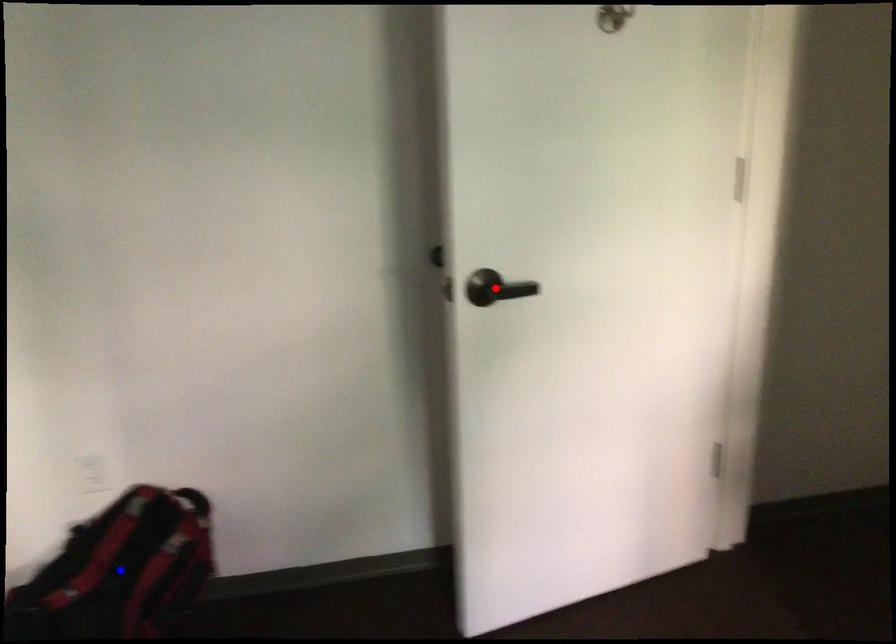
Question: Two points are marked on the image. Which point is closer to the camera?

Choices:
 (A) Blue point is closer.
 (B) Red point is closer.

Answer: (B)